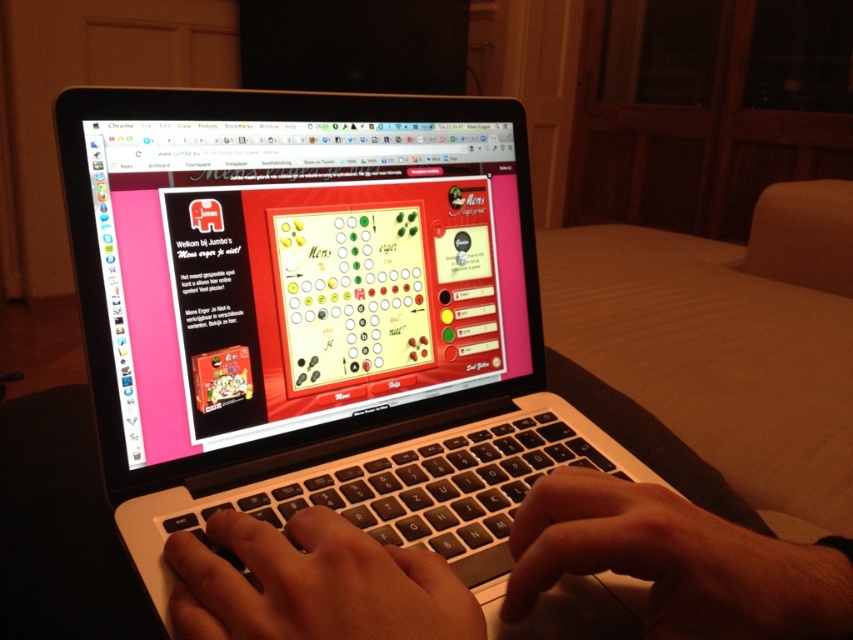
Consider the image. Between dark skin hand at lower center and white plastic keyboard at center, which one is positioned higher?

dark skin hand at lower center is above.

Is point (758, 605) closer to camera compared to point (375, 464)?

That is True.

Who is more forward, [729,624] or [479,531]?

Positioned in front is point [729,624].

Find the location of a particular element. dark skin hand at lower center is located at coordinates (676, 561).

Does point (312, 340) come farther from viewer compared to point (291, 609)?

Yes, point (312, 340) is farther from viewer.

The width and height of the screenshot is (853, 640). Describe the element at coordinates (322, 324) in the screenshot. I see `silver/black laptop at center` at that location.

The width and height of the screenshot is (853, 640). Find the location of `silver/black laptop at center`. silver/black laptop at center is located at coordinates (322, 324).

Looking at this image, does dark skin hand at lower center appear on the right side of black matte hand at center?

Yes, dark skin hand at lower center is to the right of black matte hand at center.

Between dark skin hand at lower center and black matte hand at center, which one appears on the right side from the viewer's perspective?

Positioned to the right is dark skin hand at lower center.

Find the location of a particular element. dark skin hand at lower center is located at coordinates (676, 561).